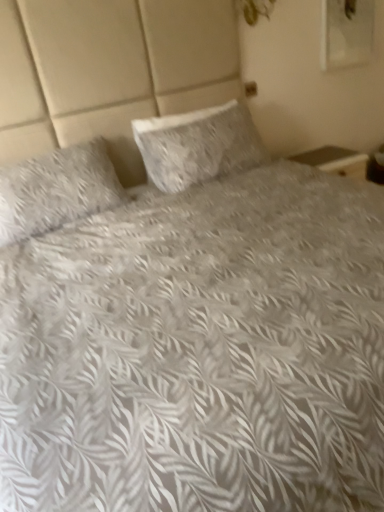
Question: Can you confirm if fluffy white pillow at left, which ranks as the 1th pillow in left-to-right order, is bigger than white textured pillow at center, which appears as the first pillow when viewed from the right?

Choices:
 (A) yes
 (B) no

Answer: (A)

Question: Is fluffy white pillow at left, placed as the second pillow when sorted from right to left, far away from white textured pillow at center, which appears as the first pillow when viewed from the right?

Choices:
 (A) yes
 (B) no

Answer: (B)

Question: Considering the relative sizes of fluffy white pillow at left, which ranks as the 1th pillow in left-to-right order, and white textured pillow at center, the 2th pillow when ordered from left to right, in the image provided, is fluffy white pillow at left, which ranks as the 1th pillow in left-to-right order, taller than white textured pillow at center, the 2th pillow when ordered from left to right,?

Choices:
 (A) no
 (B) yes

Answer: (B)

Question: Is fluffy white pillow at left, placed as the second pillow when sorted from right to left, turned away from white textured pillow at center, the 2th pillow when ordered from left to right?

Choices:
 (A) yes
 (B) no

Answer: (B)

Question: Is fluffy white pillow at left, which ranks as the 1th pillow in left-to-right order, located outside white textured pillow at center, which appears as the first pillow when viewed from the right?

Choices:
 (A) no
 (B) yes

Answer: (B)

Question: Is fluffy white pillow at left, placed as the second pillow when sorted from right to left, in contact with white textured pillow at center, which appears as the first pillow when viewed from the right?

Choices:
 (A) yes
 (B) no

Answer: (B)

Question: Considering the relative sizes of white textured pillow at center, the 2th pillow when ordered from left to right, and fluffy white pillow at left, which ranks as the 1th pillow in left-to-right order, in the image provided, is white textured pillow at center, the 2th pillow when ordered from left to right, bigger than fluffy white pillow at left, which ranks as the 1th pillow in left-to-right order,?

Choices:
 (A) yes
 (B) no

Answer: (B)

Question: From the image's perspective, is white textured pillow at center, which appears as the first pillow when viewed from the right, under fluffy white pillow at left, placed as the second pillow when sorted from right to left?

Choices:
 (A) yes
 (B) no

Answer: (B)

Question: Is white textured pillow at center, which appears as the first pillow when viewed from the right, far away from fluffy white pillow at left, placed as the second pillow when sorted from right to left?

Choices:
 (A) no
 (B) yes

Answer: (A)

Question: From a real-world perspective, is white textured pillow at center, the 2th pillow when ordered from left to right, located beneath fluffy white pillow at left, placed as the second pillow when sorted from right to left?

Choices:
 (A) yes
 (B) no

Answer: (A)

Question: Can we say white textured pillow at center, which appears as the first pillow when viewed from the right, lies outside fluffy white pillow at left, placed as the second pillow when sorted from right to left?

Choices:
 (A) yes
 (B) no

Answer: (A)

Question: Does white textured pillow at center, the 2th pillow when ordered from left to right, appear on the left side of fluffy white pillow at left, which ranks as the 1th pillow in left-to-right order?

Choices:
 (A) yes
 (B) no

Answer: (B)

Question: Visually, is white textured pillow at center, which appears as the first pillow when viewed from the right, positioned to the left or to the right of fluffy white pillow at left, which ranks as the 1th pillow in left-to-right order?

Choices:
 (A) right
 (B) left

Answer: (A)